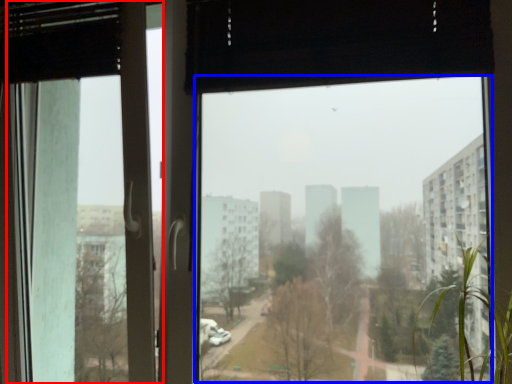
Question: Which object appears closest to the camera in this image, screen door (highlighted by a red box) or window screen (highlighted by a blue box)?

Choices:
 (A) screen door
 (B) window screen

Answer: (B)